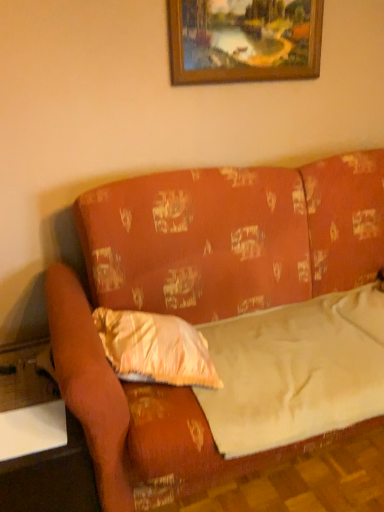
Question: Is white fabric sheet at center placed right next to white plastic table at lower left, arranged as the 2th table when ordered from the bottom?

Choices:
 (A) yes
 (B) no

Answer: (B)

Question: Is white fabric sheet at center oriented towards white plastic table at lower left, which is counted as the first table, starting from the top?

Choices:
 (A) yes
 (B) no

Answer: (B)

Question: Is white fabric sheet at center further to camera compared to white plastic table at lower left, which is counted as the first table, starting from the top?

Choices:
 (A) no
 (B) yes

Answer: (A)

Question: Can you confirm if white fabric sheet at center is taller than white plastic table at lower left, which is counted as the first table, starting from the top?

Choices:
 (A) no
 (B) yes

Answer: (B)

Question: Does white fabric sheet at center have a greater width compared to white plastic table at lower left, which is counted as the first table, starting from the top?

Choices:
 (A) no
 (B) yes

Answer: (B)

Question: From a real-world perspective, is wooden frame at upper center positioned above or below wooden glossy table at lower left, the first table in the bottom-to-top sequence?

Choices:
 (A) below
 (B) above

Answer: (B)

Question: Would you say wooden frame at upper center is inside or outside wooden glossy table at lower left, positioned as the second table in top-to-bottom order?

Choices:
 (A) outside
 (B) inside

Answer: (A)

Question: Looking at the image, does wooden frame at upper center seem bigger or smaller compared to wooden glossy table at lower left, positioned as the second table in top-to-bottom order?

Choices:
 (A) big
 (B) small

Answer: (B)

Question: Is wooden frame at upper center wider or thinner than wooden glossy table at lower left, positioned as the second table in top-to-bottom order?

Choices:
 (A) thin
 (B) wide

Answer: (A)

Question: Is point (46, 510) closer or farther from the camera than point (286, 70)?

Choices:
 (A) closer
 (B) farther

Answer: (A)

Question: Considering the positions of wooden glossy table at lower left, the first table in the bottom-to-top sequence, and wooden frame at upper center in the image, is wooden glossy table at lower left, the first table in the bottom-to-top sequence, wider or thinner than wooden frame at upper center?

Choices:
 (A) thin
 (B) wide

Answer: (B)

Question: Based on their positions, is wooden glossy table at lower left, the first table in the bottom-to-top sequence, located to the left or right of wooden frame at upper center?

Choices:
 (A) left
 (B) right

Answer: (A)

Question: Is wooden glossy table at lower left, positioned as the second table in top-to-bottom order, in front of or behind wooden frame at upper center in the image?

Choices:
 (A) front
 (B) behind

Answer: (A)

Question: Is shiny gold pillow at center-left taller or shorter than wooden glossy table at lower left, the first table in the bottom-to-top sequence?

Choices:
 (A) tall
 (B) short

Answer: (B)

Question: From a real-world perspective, relative to wooden glossy table at lower left, the first table in the bottom-to-top sequence, is shiny gold pillow at center-left vertically above or below?

Choices:
 (A) above
 (B) below

Answer: (A)